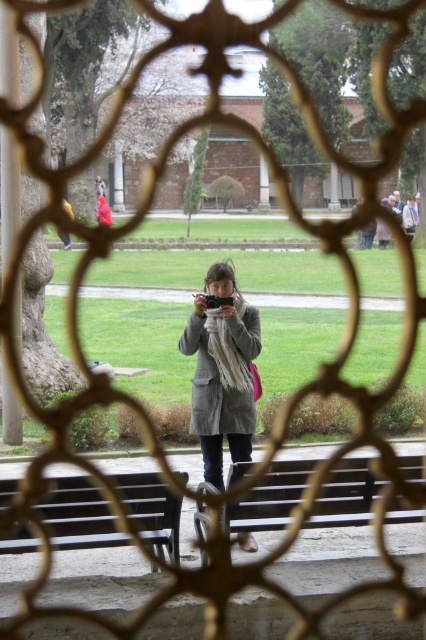
Between point (365, 472) and point (235, 371), which one is positioned in front?

Point (365, 472) is more forward.

Is wooden bench at center below knitted beige scarf at center?

Yes, wooden bench at center is below knitted beige scarf at center.

Where is `wooden bench at center`? The image size is (426, 640). wooden bench at center is located at coordinates (268, 499).

Is matte gray coat at center wider than wooden bench at center?

Incorrect, matte gray coat at center's width does not surpass wooden bench at center's.

Looking at this image, can you confirm if matte gray coat at center is positioned above wooden bench at center?

Yes, matte gray coat at center is above wooden bench at center.

Between point (245, 356) and point (344, 508), which one is positioned in front?

Point (344, 508) is in front.

Locate an element on the screen. matte gray coat at center is located at coordinates (221, 371).

Which is more to the right, dark brown wooden bench at lower left or knitted beige scarf at center?

Positioned to the right is knitted beige scarf at center.

Between dark brown wooden bench at lower left and knitted beige scarf at center, which one appears on the left side from the viewer's perspective?

dark brown wooden bench at lower left

Who is more forward, [161,554] or [227,358]?

Point [161,554] is more forward.

At what (x,y) coordinates should I click in order to perform the action: click on dark brown wooden bench at lower left. Please return your answer as a coordinate pair (x, y). The height and width of the screenshot is (640, 426). Looking at the image, I should click on (80, 516).